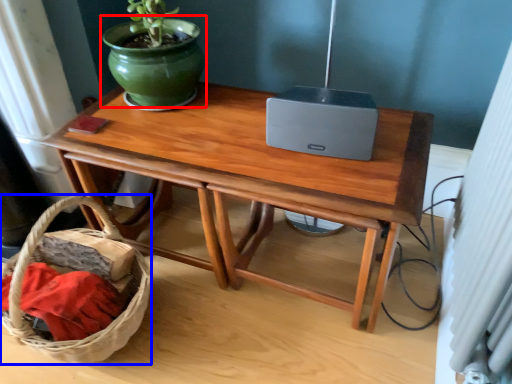
Question: Which point is further to the camera, flowerpot (highlighted by a red box) or basket (highlighted by a blue box)?

Choices:
 (A) flowerpot
 (B) basket

Answer: (A)